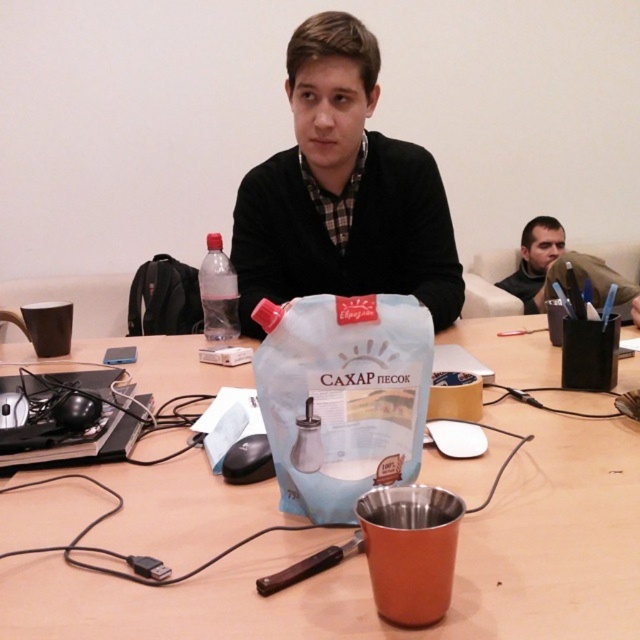
Question: Is black matte sweater at center positioned before white matte paper bag at center?

Choices:
 (A) no
 (B) yes

Answer: (A)

Question: Which object appears closest to the camera in this image?

Choices:
 (A) matte brown jacket at upper right
 (B) white matte paper bag at center
 (C) matte black jacket at upper right
 (D) metallic silver table at center

Answer: (D)

Question: Which object appears closest to the camera in this image?

Choices:
 (A) black matte sweater at center
 (B) matte black jacket at upper right

Answer: (A)

Question: Can you confirm if white matte paper bag at center is positioned above matte brown jacket at upper right?

Choices:
 (A) yes
 (B) no

Answer: (B)

Question: Is metallic silver table at center below matte brown jacket at upper right?

Choices:
 (A) yes
 (B) no

Answer: (A)

Question: Based on their relative distances, which object is nearer to the matte black jacket at upper right?

Choices:
 (A) transparent plastic bottle at center
 (B) black matte sweater at center
 (C) matte brown jacket at upper right
 (D) metallic silver table at center

Answer: (C)